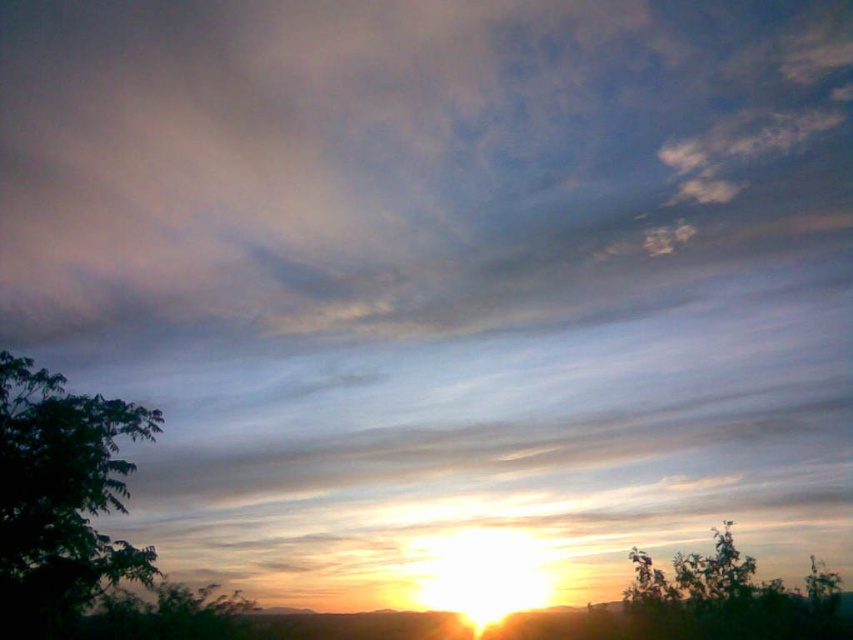
Question: From the image, what is the correct spatial relationship of green leafy tree at left in relation to green leafy tree at lower right?

Choices:
 (A) below
 (B) above

Answer: (B)

Question: Which point is closer to the camera?

Choices:
 (A) green leafy tree at left
 (B) green leafy tree at lower right

Answer: (A)

Question: Does green leafy tree at left appear on the left side of green leafy tree at lower right?

Choices:
 (A) yes
 (B) no

Answer: (A)

Question: Which object appears farthest from the camera in this image?

Choices:
 (A) green leafy tree at lower right
 (B) green leafy tree at left

Answer: (A)

Question: Which point appears farthest from the camera in this image?

Choices:
 (A) (630, 611)
 (B) (4, 513)

Answer: (A)

Question: Can you confirm if green leafy tree at left is positioned above green leafy tree at lower right?

Choices:
 (A) yes
 (B) no

Answer: (A)